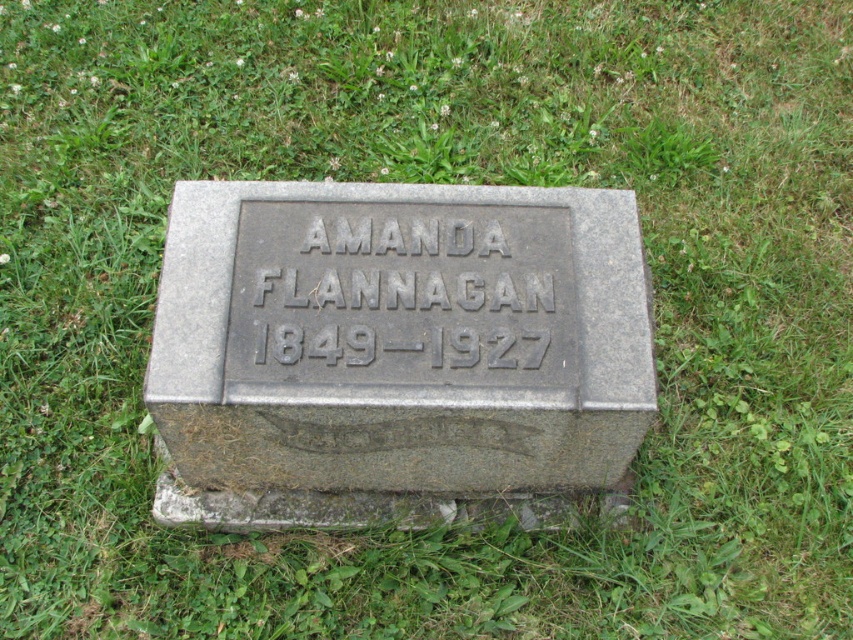
You are standing at the origin point of the coordinate system. You want to place a new flower pot 0.3 meters to the right of the gray stone gravestone at center. What are the coordinates of the flower pot?

The gray stone gravestone at center is at point (395, 349). Moving 0.3 meters to the right would add 0.3 to the x coordinate, resulting in coordinates (395, 541) for the flower pot.

You are a landscape architect designing a memorial garden. You need to place a new statue that is 2 meters tall. The statue must be placed in front of the gray stone gravestone at center so that it doesn,t block the view of the black engraved stone at center. Can the statue be placed there?

The gray stone gravestone at center has a greater height compared to black engraved stone at center. Since the statue is 2 meters tall and placed in front of the taller gray stone gravestone, it might block the view of the shorter black engraved stone at center if they are aligned. To ensure visibility, the statue should be positioned to the side or at an angle so that both monuments remain visible.

You are standing at the point with coordinates point (294,282) and want to walk towards the point with coordinates point (485,326). According to the image, will you be moving towards the gravestone or away from it?

Point (485,326) is in front of point (294,282). Since you are moving towards the point in front, you are moving towards the gravestone.